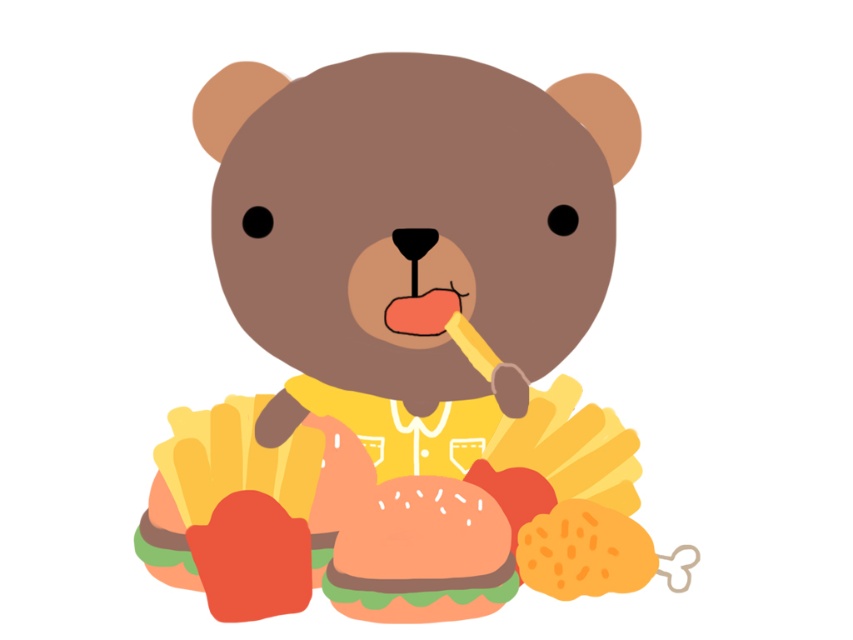
Which is in front, point (526, 317) or point (412, 588)?

Point (412, 588) is more forward.

Is point (279, 138) positioned behind point (444, 493)?

Yes, point (279, 138) is behind point (444, 493).

Locate an element on the screen. matte yellow bear at center is located at coordinates (405, 349).